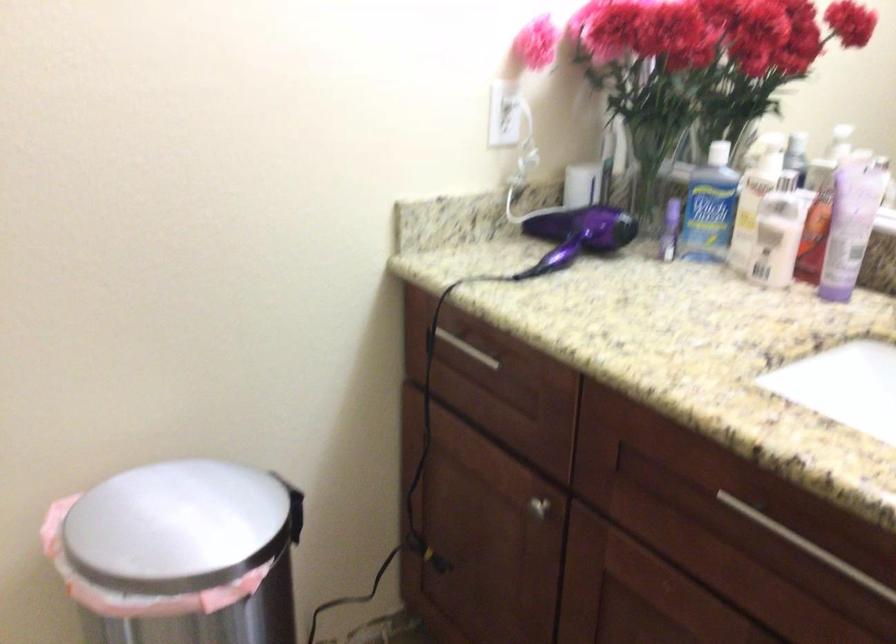
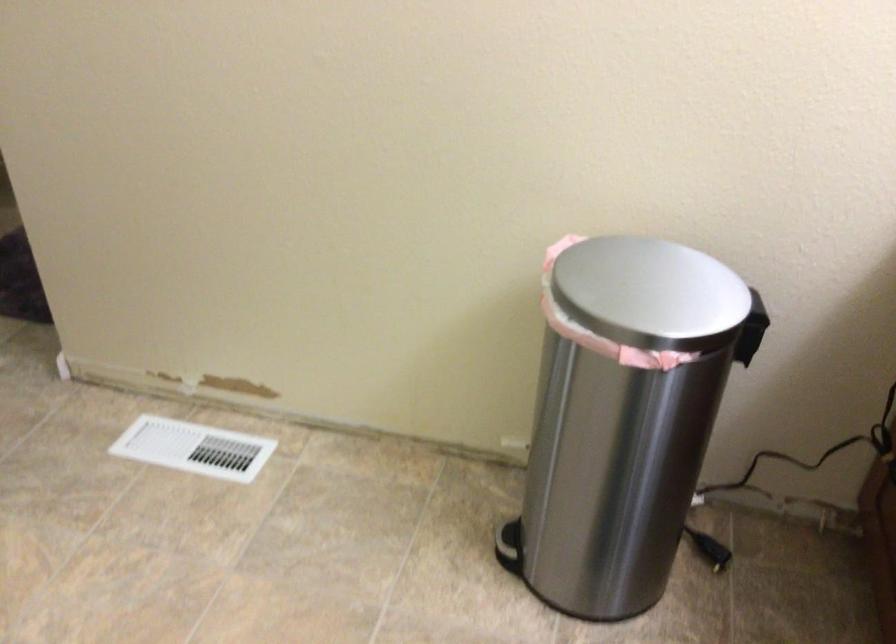
Based on the photo, the images are taken continuously from a first-person perspective. In which direction is your viewpoint rotating?

The camera's rotation is toward left-down.